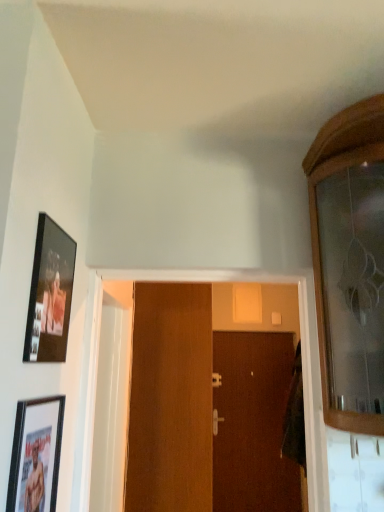
Question: Visually, is wooden door at center, arranged as the second door when viewed from the right, positioned to the left or to the right of matte black picture frame at upper left, which is the 1th picture frame in top-to-bottom order?

Choices:
 (A) left
 (B) right

Answer: (B)

Question: From a real-world perspective, relative to matte black picture frame at upper left, which is the 1th picture frame in top-to-bottom order, is wooden door at center, the first door in the front-to-back sequence, vertically above or below?

Choices:
 (A) below
 (B) above

Answer: (A)

Question: Estimate the real-world distances between objects in this image. Which object is closer to the matte black picture frame at lower left, acting as the second picture frame starting from the top?

Choices:
 (A) matte black picture frame at upper left, placed as the 2th picture frame when sorted from bottom to top
 (B) brown wooden door at center, positioned as the 1th door in back-to-front order
 (C) silver metallic door handle at center, marked as the 2th door handle in a back-to-front arrangement
 (D) wooden door at center, arranged as the second door when viewed from the right
 (E) silver metallic door handle at center, the first door handle from the back

Answer: (A)

Question: Estimate the real-world distances between objects in this image. Which object is closer to the matte black picture frame at upper left, which is the 1th picture frame in top-to-bottom order?

Choices:
 (A) matte black picture frame at lower left, acting as the second picture frame starting from the top
 (B) brown wooden door at center, which is the 2th door from front to back
 (C) silver metallic door handle at center, the second door handle from the bottom
 (D) wooden door at center, the first door in the front-to-back sequence
 (E) silver metallic door handle at center, which is counted as the 1th door handle, starting from the bottom

Answer: (A)